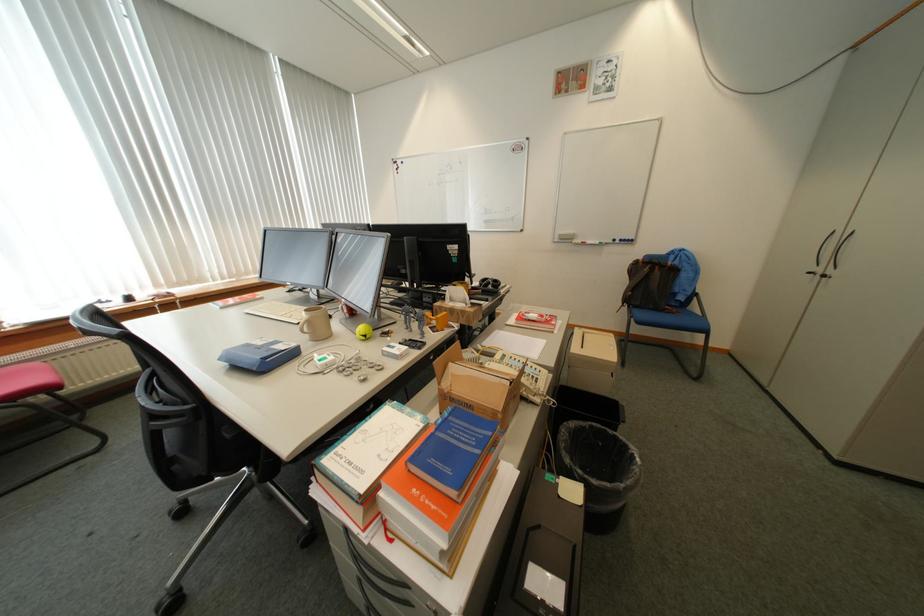
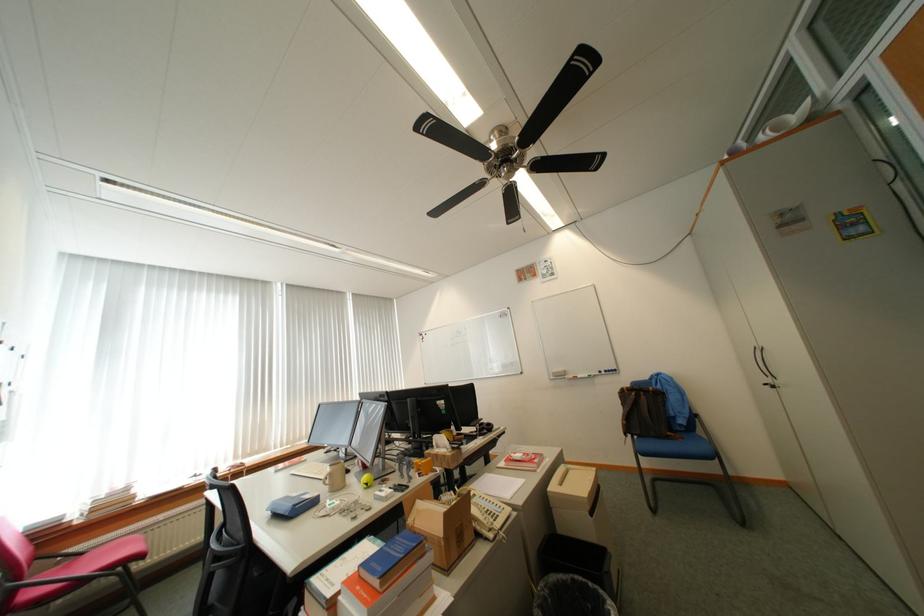
Find the pixel in the second image that matches (666,273) in the first image.

(652, 399)